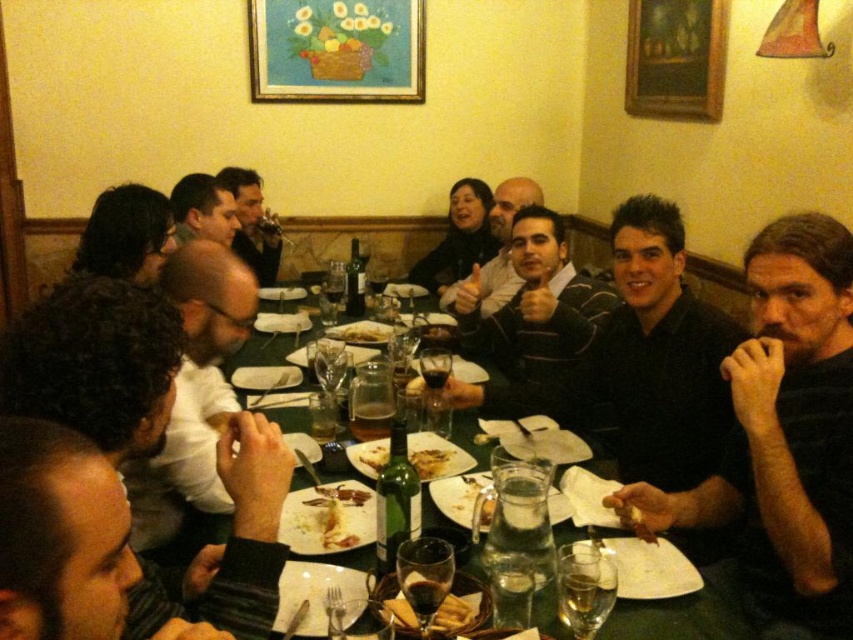
Based on the photo, who is positioned more to the left, matte black shirt at center or smooth black shirt at center?

smooth black shirt at center is more to the left.

Can you confirm if matte black shirt at center is positioned to the left of smooth black shirt at center?

Incorrect, matte black shirt at center is not on the left side of smooth black shirt at center.

Based on the photo, who is more forward, [496,307] or [244,257]?

Positioned in front is point [496,307].

Find the location of `matte black shirt at center`. matte black shirt at center is located at coordinates (495, 253).

Which is in front, point (311, 504) or point (235, 196)?

Positioned in front is point (311, 504).

Is white creamy pasta at center to the left of smooth black shirt at center from the viewer's perspective?

Incorrect, white creamy pasta at center is not on the left side of smooth black shirt at center.

Who is more forward, [329,486] or [230,179]?

Answer: Point [329,486] is in front.

You are a GUI agent. You are given a task and a screenshot of the screen. Output one action in this format:
    pyautogui.click(x=<x>, y=<y>)
    Task: Click on the white creamy pasta at center
    This screenshot has height=640, width=853.
    Given the screenshot: What is the action you would take?
    pyautogui.click(x=329, y=518)

Based on the photo, is green matte table at center bigger than golden crispy bread at center?

Yes, green matte table at center is bigger than golden crispy bread at center.

Can you confirm if green matte table at center is positioned to the right of golden crispy bread at center?

No, green matte table at center is not to the right of golden crispy bread at center.

Is point (451, 461) less distant than point (360, 458)?

That is True.

Identify the location of green matte table at center. The width and height of the screenshot is (853, 640). (219, 316).